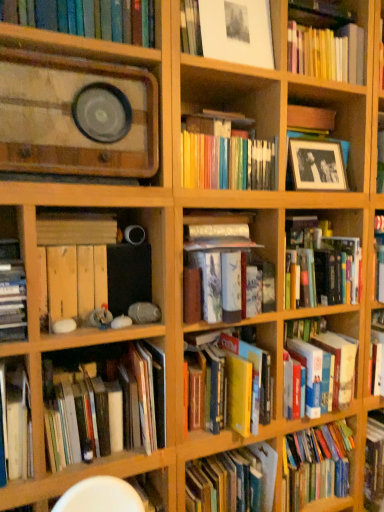
Question: Is hardcover books at lower left, acting as the 1th book starting from the bottom, looking in the opposite direction of hardcover book at center, positioned as the 7th book in bottom-to-top order?

Choices:
 (A) yes
 (B) no

Answer: (B)

Question: Is hardcover books at lower left, acting as the 1th book starting from the bottom, positioned behind hardcover book at center, which appears as the fifth book when viewed from the top?

Choices:
 (A) yes
 (B) no

Answer: (B)

Question: Is hardcover books at lower left, placed as the 11th book when sorted from top to bottom, to the left of hardcover book at center, which appears as the fifth book when viewed from the top, from the viewer's perspective?

Choices:
 (A) yes
 (B) no

Answer: (A)

Question: From the image's perspective, would you say hardcover books at lower left, placed as the 11th book when sorted from top to bottom, is positioned over hardcover book at center, which appears as the fifth book when viewed from the top?

Choices:
 (A) no
 (B) yes

Answer: (A)

Question: From the image's perspective, would you say hardcover books at lower left, acting as the 1th book starting from the bottom, is shown under hardcover book at center, positioned as the 7th book in bottom-to-top order?

Choices:
 (A) yes
 (B) no

Answer: (A)

Question: Considering the relative sizes of hardcover books at lower left, acting as the 1th book starting from the bottom, and hardcover book at center, positioned as the 7th book in bottom-to-top order, in the image provided, is hardcover books at lower left, acting as the 1th book starting from the bottom, taller than hardcover book at center, positioned as the 7th book in bottom-to-top order,?

Choices:
 (A) yes
 (B) no

Answer: (A)

Question: Is hardcover book at center, which is the 10th book in top-to-bottom order, outside of wooden crate at lower left, the fourth book when ordered from top to bottom?

Choices:
 (A) no
 (B) yes

Answer: (B)

Question: Is hardcover book at center, which is counted as the second book, starting from the bottom, facing towards wooden crate at lower left, the fourth book when ordered from top to bottom?

Choices:
 (A) no
 (B) yes

Answer: (A)

Question: From a real-world perspective, is hardcover book at center, which is the 10th book in top-to-bottom order, beneath wooden crate at lower left, the fourth book when ordered from top to bottom?

Choices:
 (A) no
 (B) yes

Answer: (B)

Question: From the image's perspective, is hardcover book at center, which is the 10th book in top-to-bottom order, above wooden crate at lower left, the eighth book ordered from the bottom?

Choices:
 (A) yes
 (B) no

Answer: (B)

Question: Is hardcover book at center, which is the 10th book in top-to-bottom order, touching wooden crate at lower left, the eighth book ordered from the bottom?

Choices:
 (A) yes
 (B) no

Answer: (B)

Question: Is hardcover book at center, which is the 10th book in top-to-bottom order, bigger than wooden crate at lower left, the eighth book ordered from the bottom?

Choices:
 (A) no
 (B) yes

Answer: (B)

Question: Can you confirm if hardcover books at lower left, placed as the 11th book when sorted from top to bottom, is smaller than wooden crate at lower left, the fourth book when ordered from top to bottom?

Choices:
 (A) yes
 (B) no

Answer: (B)